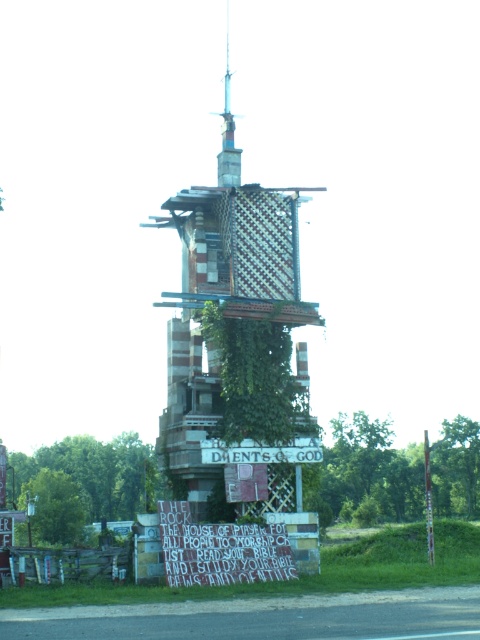
Question: Which point is closer to the camera?

Choices:
 (A) (312, 452)
 (B) (228, 428)
 (C) (425, 515)

Answer: (B)

Question: Is rusty metal tower at center above white wooden sign at center?

Choices:
 (A) yes
 (B) no

Answer: (A)

Question: Which is nearer to the white wooden sign at center?

Choices:
 (A) rusty metal tower at center
 (B) green wood pole at right
 (C) green leafy ivy at center

Answer: (C)

Question: Can you confirm if white wooden sign at center is positioned to the left of green wood pole at right?

Choices:
 (A) no
 (B) yes

Answer: (B)

Question: Can you confirm if rusty metal tower at center is positioned below green leafy ivy at center?

Choices:
 (A) yes
 (B) no

Answer: (B)

Question: Which point appears farthest from the camera in this image?

Choices:
 (A) tap(219, 426)
 (B) tap(261, 448)
 (C) tap(180, 216)
 (D) tap(431, 500)

Answer: (D)